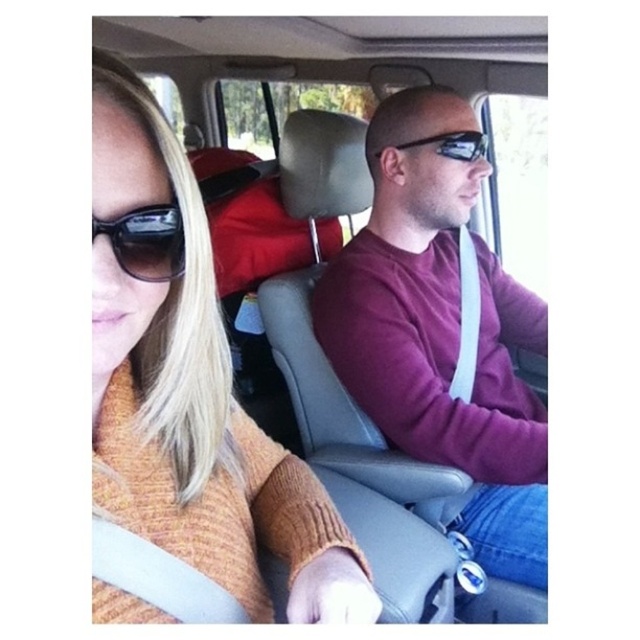
You are a passenger in a car and notice two items inside the vehicle. You see the orange knitted sweater at left and the red fabric seat at center. Which item is taller?

The orange knitted sweater at left is much taller than the red fabric seat at center.

You are a passenger in the car and want to place your matte black sunglasses at upper left on the red fabric seat at center. Will the sunglasses fit on the seat?

The red fabric seat at center has a greater height compared to matte black sunglasses at upper left, so the sunglasses will fit on the seat.

You are sitting in the back seat of the car and want to hand a gift to the person wearing the orange knitted sweater at left. Based on their position in the car, where should you place the gift so it reaches them easily?

The orange knitted sweater at left is located at point (188, 413), so you should place the gift near the left side of the car, closer to the driver seat if the passenger is on the left.